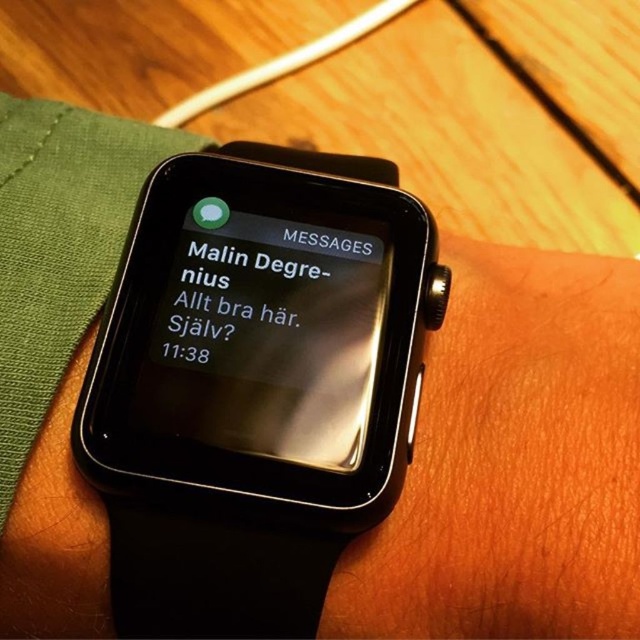
You are designing a digital sticker to place on the smartwatch screen. The sticker needs to be positioned at coordinates point 0.530, 0.414. Will the sticker overlap with the black glass watch face at center?

The black glass watch face at center is located at point (264, 339), so placing the sticker at those coordinates will directly overlap with the black glass watch face at center.

You are designing a new smartwatch case that needs to fit over both the black matte smartwatch at center and the black glass watch face at center. If the case must accommodate the taller object, which one should the case be designed to fit around?

The black matte smartwatch at center is taller than the black glass watch face at center, so the case should be designed to fit around the black matte smartwatch at center to accommodate its height.